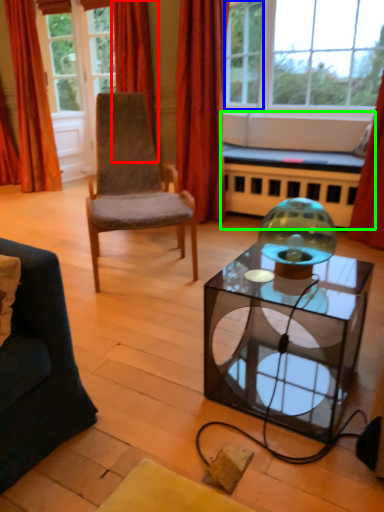
Question: Which is farther away from curtain (highlighted by a red box)? window (highlighted by a blue box) or couch (highlighted by a green box)?

Choices:
 (A) window
 (B) couch

Answer: (A)